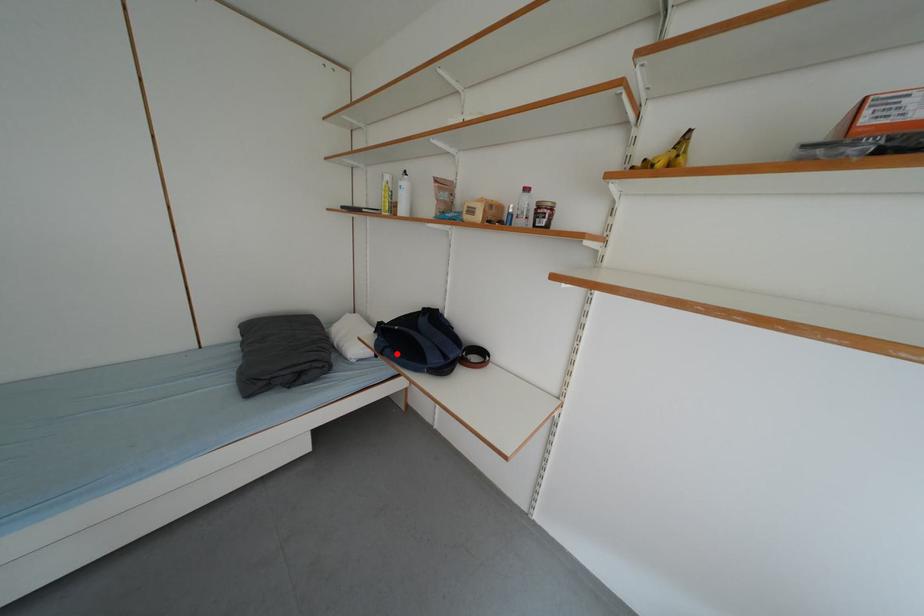
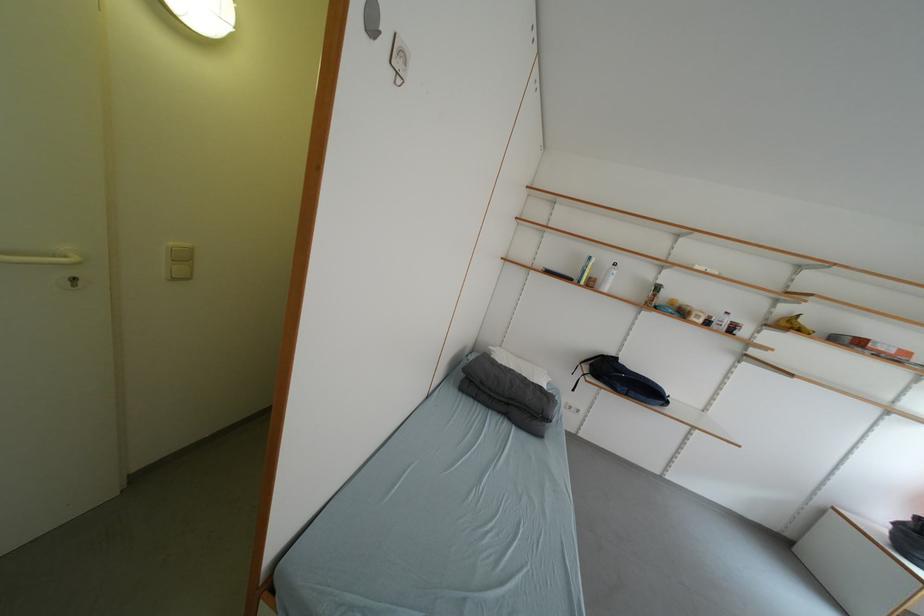
In the second image, find the point that corresponds to the highlighted location in the first image.

(640, 395)